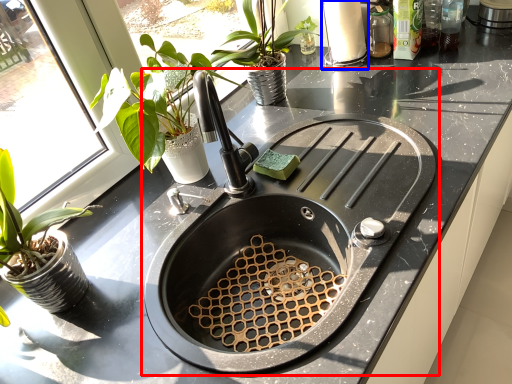
Question: Which object appears closest to the camera in this image, sink (highlighted by a red box) or appliance (highlighted by a blue box)?

Choices:
 (A) sink
 (B) appliance

Answer: (A)